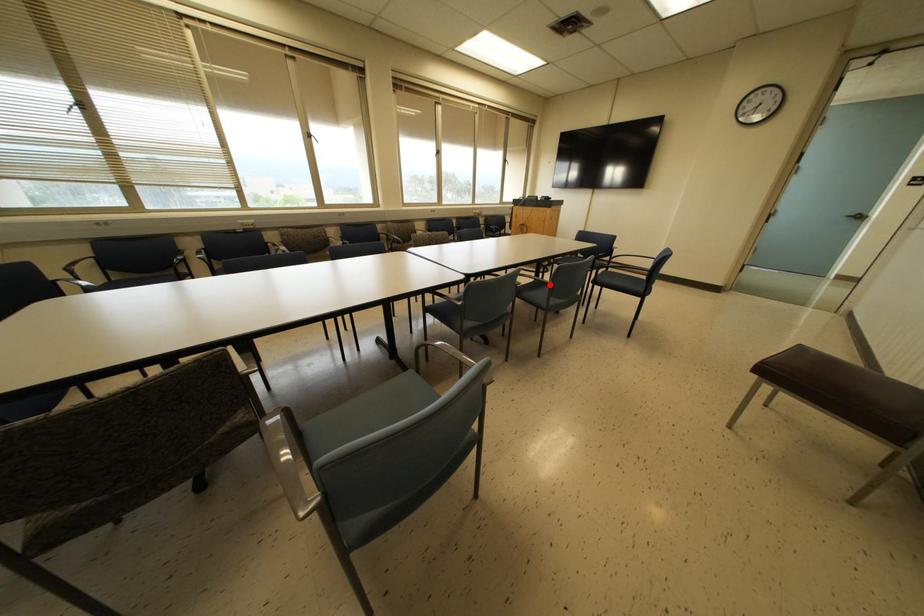
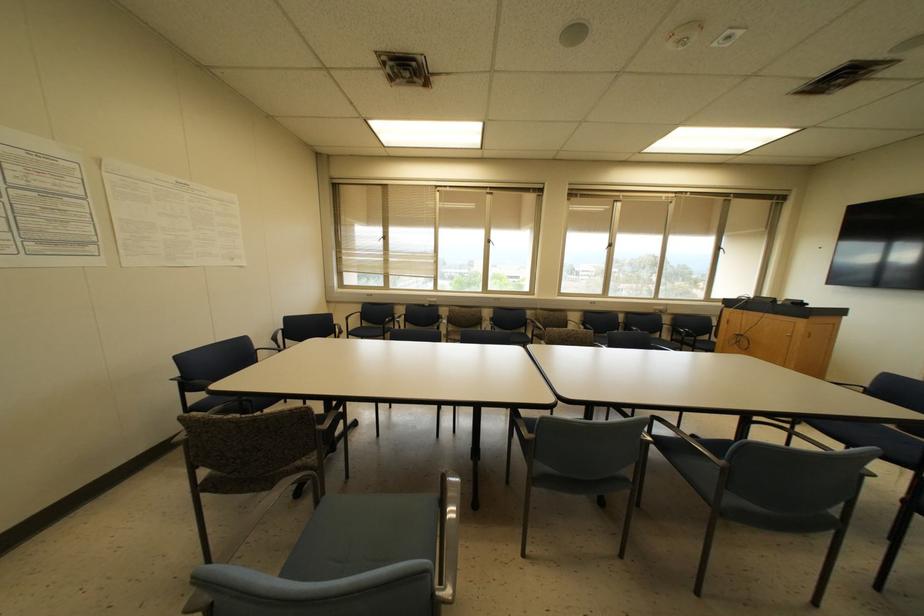
Locate, in the second image, the point that corresponds to the highlighted location in the first image.

(723, 468)